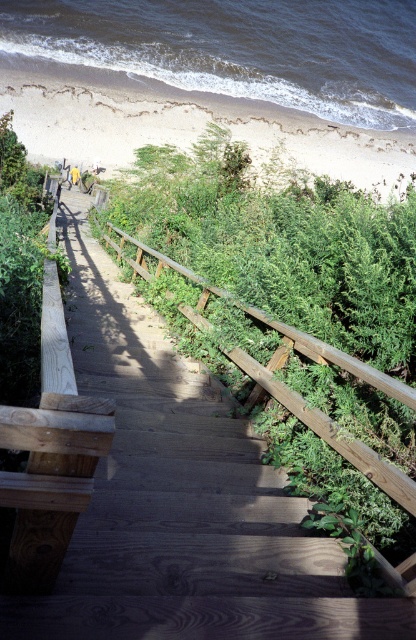
Which is more to the left, white sandy beach at upper left or wooden rail at center?

Positioned to the left is wooden rail at center.

Measure the distance between white sandy beach at upper left and camera.

white sandy beach at upper left and camera are 28.87 meters apart from each other.

Image resolution: width=416 pixels, height=640 pixels. Find the location of `white sandy beach at upper left`. white sandy beach at upper left is located at coordinates point(183,124).